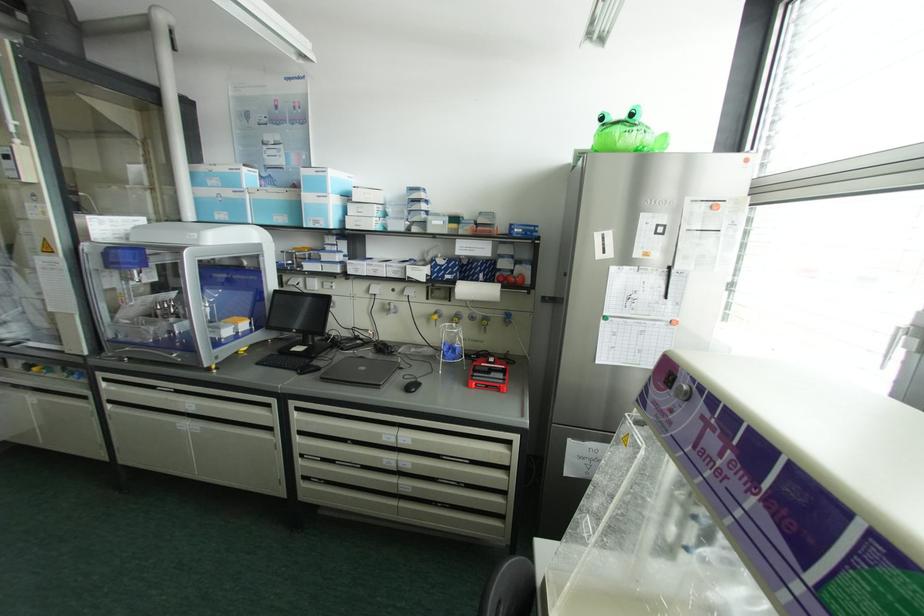
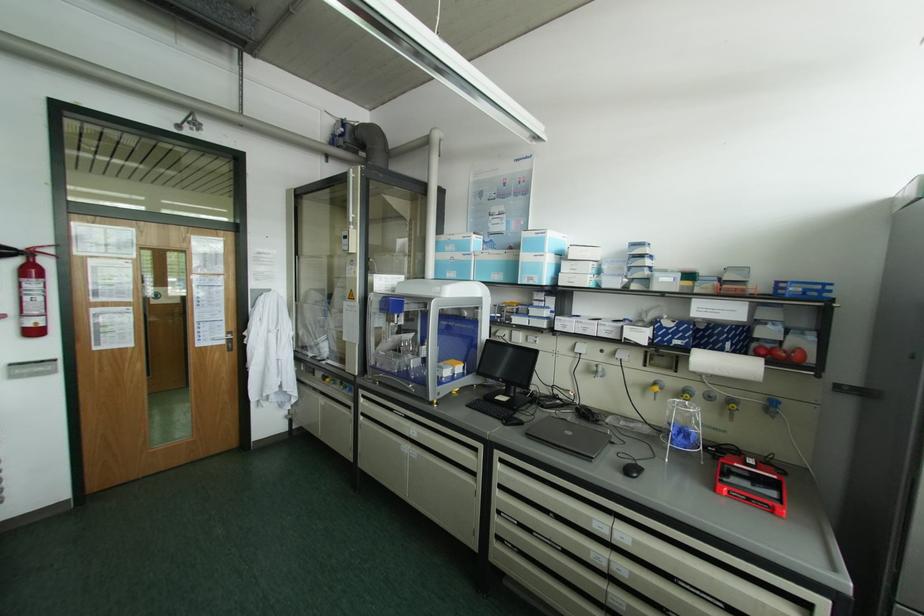
Where in the second image is the point corresponding to point (511, 314) from the first image?

(777, 402)